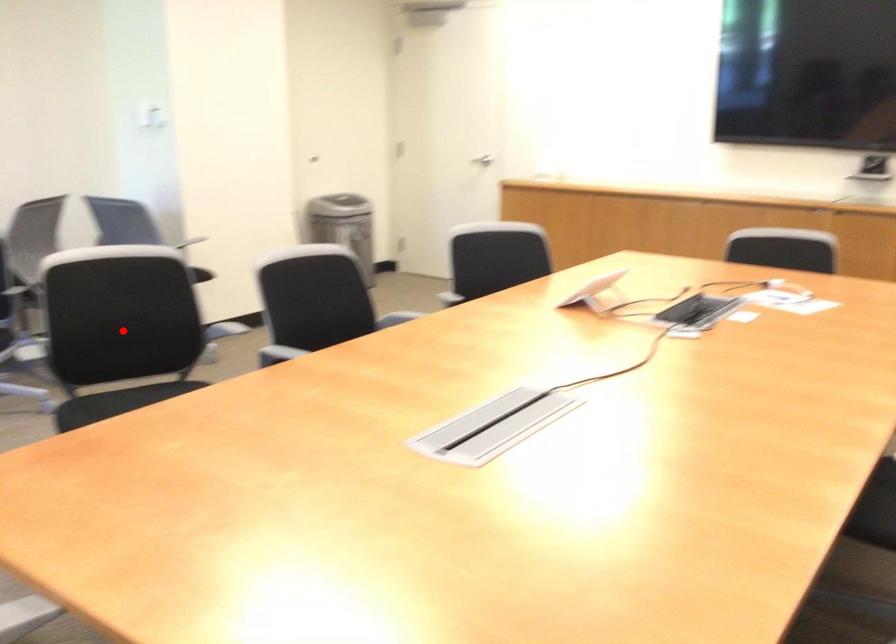
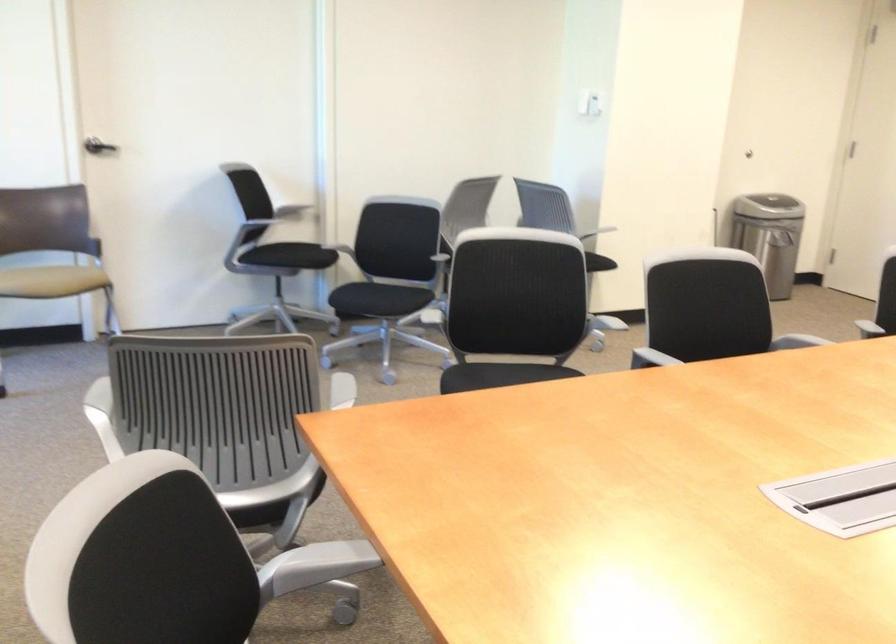
In the second image, find the point that corresponds to the highlighted location in the first image.

(513, 307)